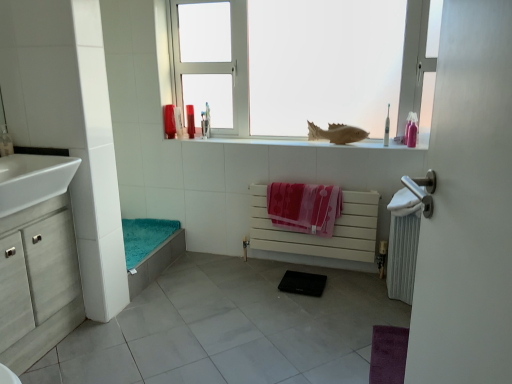
The height and width of the screenshot is (384, 512). Identify the location of vacant space situated on the left part of white matte radiator at center, which ranks as the first radiator in left-to-right order. (234, 281).